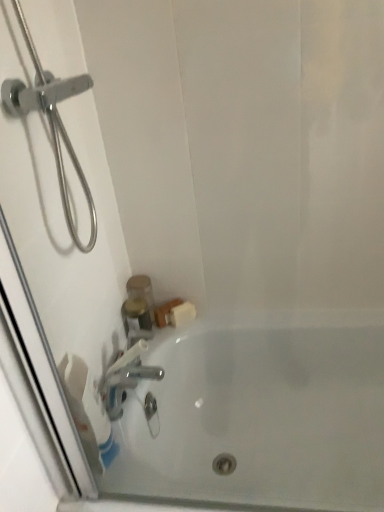
Question: Considering the positions of silver metallic faucet at lower left and white glossy bathtub at lower center in the image, is silver metallic faucet at lower left wider or thinner than white glossy bathtub at lower center?

Choices:
 (A) wide
 (B) thin

Answer: (B)

Question: From the image's perspective, is silver metallic faucet at lower left above or below white glossy bathtub at lower center?

Choices:
 (A) above
 (B) below

Answer: (A)

Question: Estimate the real-world distances between objects in this image. Which object is farther from the silver metallic faucet at lower left?

Choices:
 (A) white glossy bathtub at lower center
 (B) translucent plastic container at upper left
 (C) white matte toilet paper at lower left

Answer: (A)

Question: Which of these objects is positioned closest to the white glossy bathtub at lower center?

Choices:
 (A) translucent plastic container at upper left
 (B) white matte toilet paper at lower left
 (C) silver metallic faucet at lower left

Answer: (C)